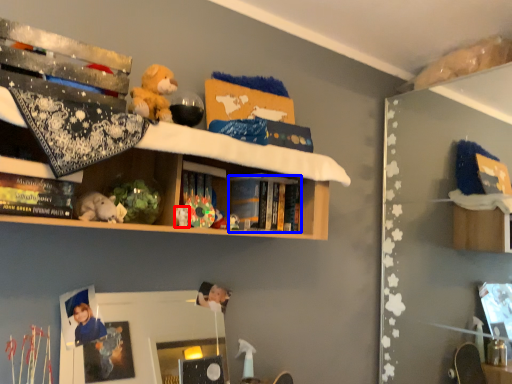
Question: Which point is further to the camera, toy (highlighted by a red box) or book (highlighted by a blue box)?

Choices:
 (A) toy
 (B) book

Answer: (B)